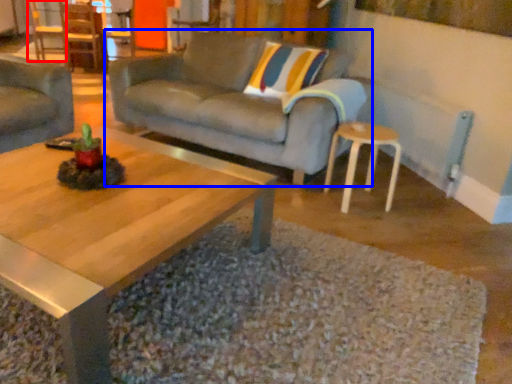
Question: Among these objects, which one is farthest to the camera, chair (highlighted by a red box) or studio couch (highlighted by a blue box)?

Choices:
 (A) chair
 (B) studio couch

Answer: (A)